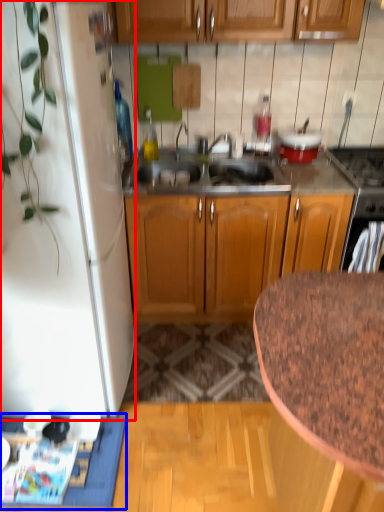
Question: Which object appears closest to the camera in this image, refrigerator (highlighted by a red box) or doormat (highlighted by a blue box)?

Choices:
 (A) refrigerator
 (B) doormat

Answer: (A)